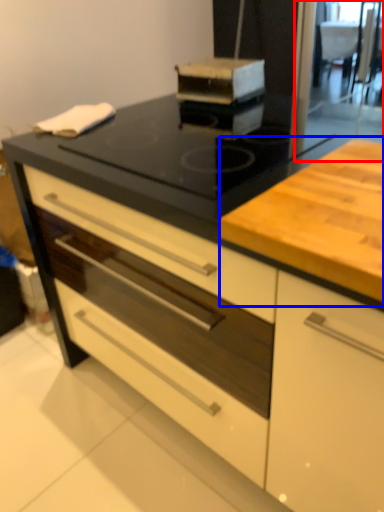
Question: Which object is further to the camera taking this photo, screen door (highlighted by a red box) or counter (highlighted by a blue box)?

Choices:
 (A) screen door
 (B) counter

Answer: (A)